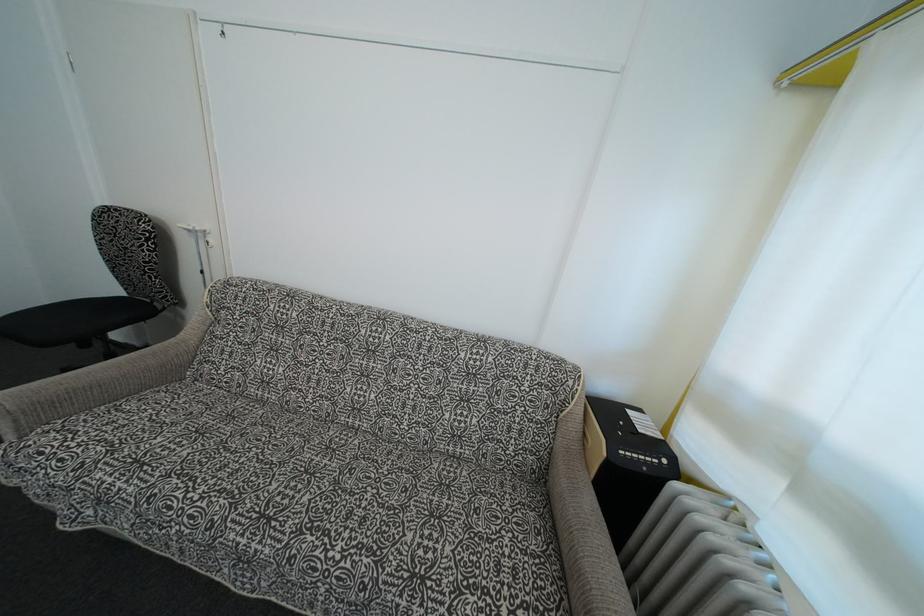
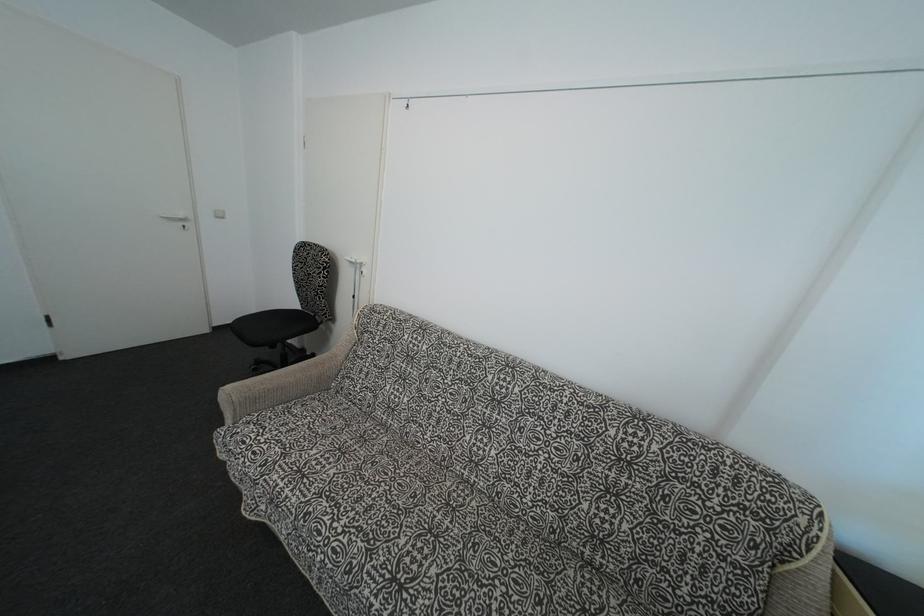
Question: How did the camera likely rotate?

Choices:
 (A) Left
 (B) Right
 (C) Up
 (D) Down

Answer: (A)